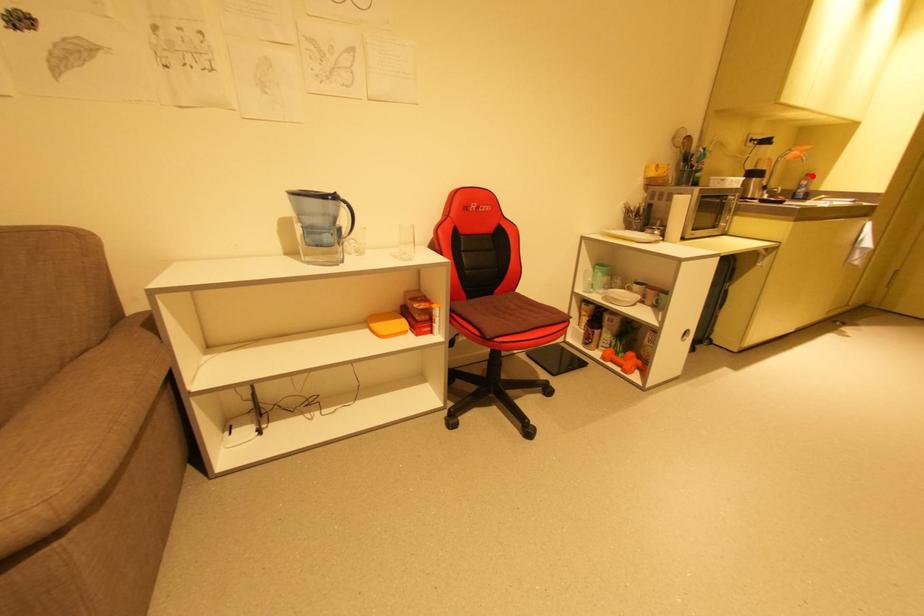
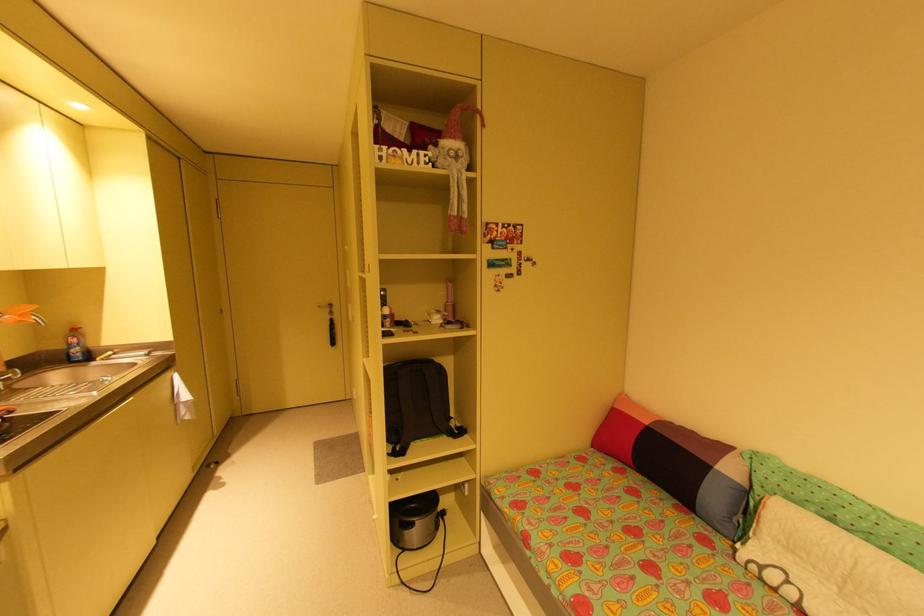
Locate, in the second image, the point that corresponds to the highlighted location in the first image.

(79, 331)